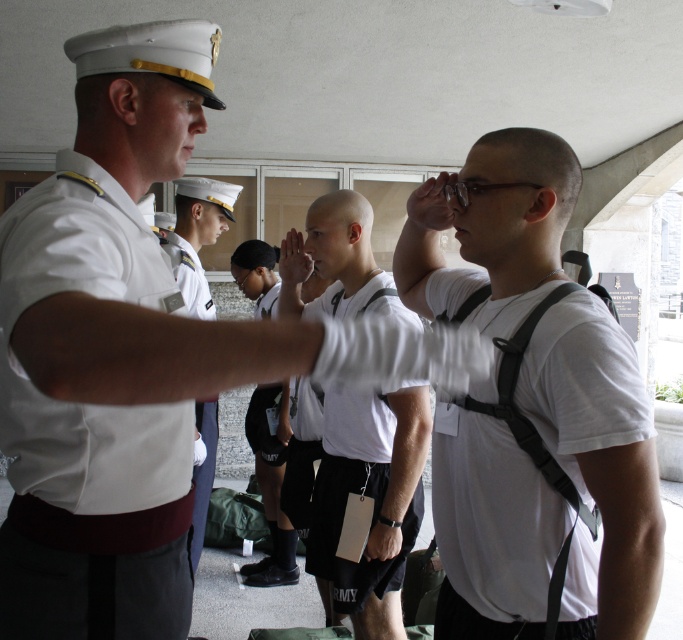
Question: Which object is closer to the camera taking this photo?

Choices:
 (A) white matte uniform at center
 (B) white uniform at center
 (C) white matte t-shirt at right
 (D) white matte shirt at center

Answer: (A)

Question: Observing the image, what is the correct spatial positioning of white matte shirt at center in reference to white uniform at center?

Choices:
 (A) below
 (B) above

Answer: (A)

Question: Which point appears closest to the camera in this image?

Choices:
 (A) (x=197, y=240)
 (B) (x=111, y=228)
 (C) (x=473, y=605)
 (D) (x=337, y=600)

Answer: (B)

Question: Can you confirm if white smooth shirt at center is bigger than white matte shirt at center?

Choices:
 (A) yes
 (B) no

Answer: (B)

Question: Considering the real-world distances, which object is farthest from the white uniform at center?

Choices:
 (A) white matte uniform at center
 (B) white matte t-shirt at right
 (C) white matte shirt at center

Answer: (B)

Question: Does white matte uniform at center have a smaller size compared to white smooth shirt at center?

Choices:
 (A) yes
 (B) no

Answer: (B)